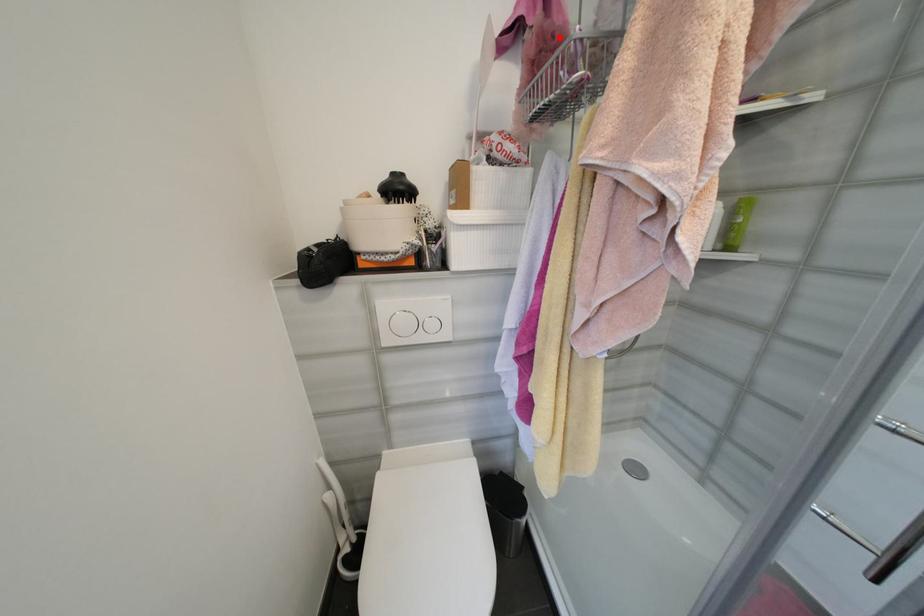
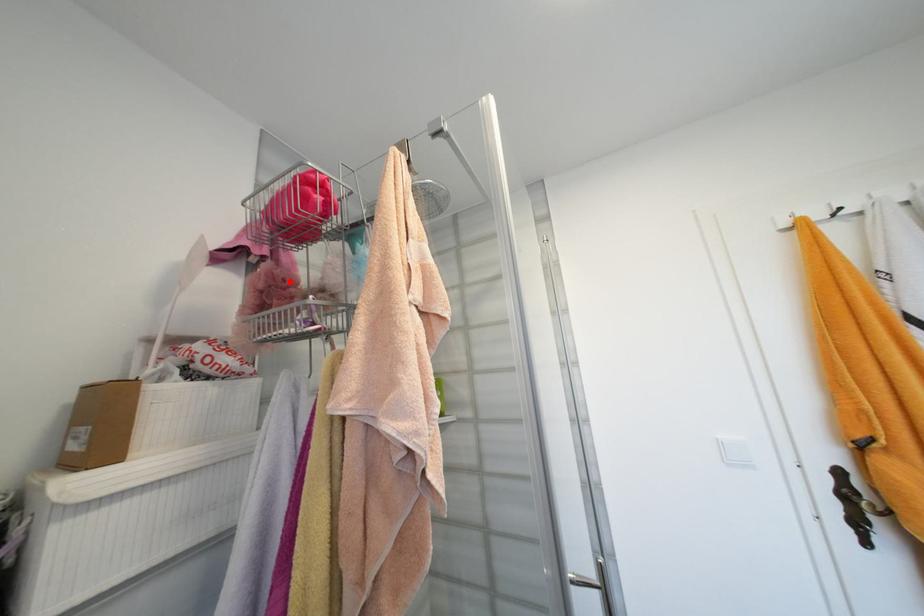
I am providing you with two images of the same scene from different viewpoints. A red point is marked on the first image and another point is marked on the second image. Does the point marked in image1 correspond to the same location as the one in image2?

Yes